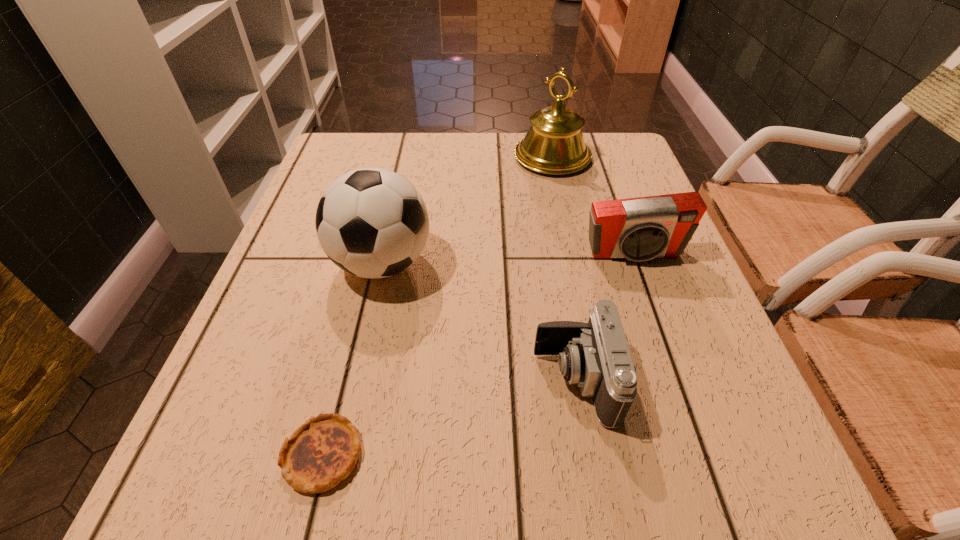
Locate an element on the screen. The height and width of the screenshot is (540, 960). object that is at the near left corner is located at coordinates (323, 451).

Identify the location of object present at the far right corner. (554, 144).

Find the location of a particular element. The width and height of the screenshot is (960, 540). blank space at the far edge of the desktop is located at coordinates (498, 181).

This screenshot has height=540, width=960. In the image, there is a desktop. Identify the location of vacant space at the near edge. (464, 475).

Find the location of `vacant area at the left edge of the desktop`. vacant area at the left edge of the desktop is located at coordinates (300, 320).

Locate an element on the screen. The height and width of the screenshot is (540, 960). free space at the right edge of the desktop is located at coordinates (635, 325).

Image resolution: width=960 pixels, height=540 pixels. Identify the location of vacant space at the far left corner of the desktop. (354, 159).

In the image, there is a desktop. Where is `vacant area at the near right corner`? This screenshot has width=960, height=540. vacant area at the near right corner is located at coordinates pos(714,479).

Where is `empty location between the shorter camera and the bell`? The width and height of the screenshot is (960, 540). empty location between the shorter camera and the bell is located at coordinates (564, 268).

Locate an element on the screen. This screenshot has width=960, height=540. free spot between the soccer ball and the shortest object is located at coordinates (352, 359).